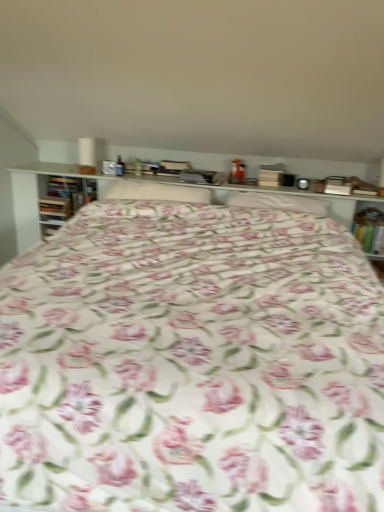
Measure the distance between point (351, 472) and camera.

The depth of point (351, 472) is 39.29 inches.

How much space does floral fabric pillow at center, the first pillow when ordered from right to left, occupy vertically?

floral fabric pillow at center, the first pillow when ordered from right to left, is 10.44 centimeters tall.

At what (x,y) coordinates should I click in order to perform the action: click on wooden book at left, which is the first book in left-to-right order. Please return your answer as a coordinate pair (x, y). The image size is (384, 512). Looking at the image, I should click on (54, 209).

From the image's perspective, count 1st books downward from the hardcover book at left, acting as the second book starting from the left, and point to it. Please provide its 2D coordinates.

[(54, 209)]

Can you tell me how much hardcover book at left, acting as the second book starting from the left, and wooden book at left, which is the first book in left-to-right order, differ in facing direction?

0.00331 degrees separate the facing orientations of hardcover book at left, acting as the second book starting from the left, and wooden book at left, which is the first book in left-to-right order.

Does point (81, 184) come behind point (42, 214)?

Yes, it is.

Is floral fabric bed at center shorter than wooden book at left, which is the first book in left-to-right order?

No, floral fabric bed at center is not shorter than wooden book at left, which is the first book in left-to-right order.

From the image's perspective, is floral fabric bed at center positioned above or below wooden book at left, which appears as the third book when viewed from the right?

floral fabric bed at center is situated lower than wooden book at left, which appears as the third book when viewed from the right, in the image.

This screenshot has height=512, width=384. Identify the location of bed below the wooden book at left, which is the first book in left-to-right order (from the image's perspective). (192, 364).

Based on their sizes in the image, would you say floral fabric bed at center is bigger or smaller than wooden book at left, which appears as the third book when viewed from the right?

Considering their sizes, floral fabric bed at center takes up more space than wooden book at left, which appears as the third book when viewed from the right.

From a real-world perspective, is hardcover book at right, which appears as the first book when viewed from the right, located beneath wooden book at left, which is the first book in left-to-right order?

Incorrect, from a real-world perspective, hardcover book at right, which appears as the first book when viewed from the right, is higher than wooden book at left, which is the first book in left-to-right order.

Is hardcover book at right, which appears as the first book when viewed from the right, placed right next to wooden book at left, which is the first book in left-to-right order?

There is a gap between hardcover book at right, which appears as the first book when viewed from the right, and wooden book at left, which is the first book in left-to-right order.

From the hardcover book at right, positioned as the third book in left-to-right order, count the 2nd book to the left and point to it. Please provide its 2D coordinates.

[(54, 209)]

Does floral fabric bed at center have a lesser width compared to hardcover book at right, which appears as the first book when viewed from the right?

Incorrect, the width of floral fabric bed at center is not less than that of hardcover book at right, which appears as the first book when viewed from the right.

Is floral fabric bed at center positioned with its back to hardcover book at right, which appears as the first book when viewed from the right?

No, floral fabric bed at center's orientation is not away from hardcover book at right, which appears as the first book when viewed from the right.

You are a GUI agent. You are given a task and a screenshot of the screen. Output one action in this format:
    pyautogui.click(x=<x>, y=<y>)
    Task: Click on the bed that is below the hardcover book at right, positioned as the third book in left-to-right order (from the image's perspective)
    
    Given the screenshot: What is the action you would take?
    pyautogui.click(x=192, y=364)

In terms of size, does hardcover book at right, which appears as the first book when viewed from the right, appear bigger or smaller than hardcover book at left, acting as the second book starting from the left?

hardcover book at right, which appears as the first book when viewed from the right, is bigger than hardcover book at left, acting as the second book starting from the left.

Looking at this image, who is shorter, hardcover book at right, positioned as the third book in left-to-right order, or hardcover book at left, which appears as the 2th book when viewed from the right?

With less height is hardcover book at right, positioned as the third book in left-to-right order.

In order to click on the 1st book positioned below the hardcover book at left, acting as the second book starting from the left (from a real-world perspective) in this screenshot , I will do point(369,230).

Consider the image. From a real-world perspective, is white fabric pillow at center, the first pillow viewed from the left, beneath wooden book at left, which appears as the third book when viewed from the right?

No, from a real-world perspective, white fabric pillow at center, the first pillow viewed from the left, is not below wooden book at left, which appears as the third book when viewed from the right.

From the image's perspective, between white fabric pillow at center, the first pillow viewed from the left, and wooden book at left, which appears as the third book when viewed from the right, who is located below?

wooden book at left, which appears as the third book when viewed from the right, is shown below in the image.

This screenshot has height=512, width=384. What are the coordinates of `the 2nd book to the left of the white fabric pillow at center, which is the second pillow in right-to-left order, starting your count from the anchor` in the screenshot? It's located at (54, 209).

Does white fabric pillow at center, the first pillow viewed from the left, turn towards wooden book at left, which appears as the third book when viewed from the right?

No, white fabric pillow at center, the first pillow viewed from the left, does not turn towards wooden book at left, which appears as the third book when viewed from the right.

Find the location of a particular element. the 2nd book to the left of the hardcover book at right, which appears as the first book when viewed from the right, counting from the anchor's position is located at coordinates (54, 209).

Are wooden book at left, which appears as the third book when viewed from the right, and hardcover book at right, positioned as the third book in left-to-right order, far apart?

wooden book at left, which appears as the third book when viewed from the right, is positioned a significant distance from hardcover book at right, positioned as the third book in left-to-right order.

Is wooden book at left, which is the first book in left-to-right order, oriented towards hardcover book at right, positioned as the third book in left-to-right order?

No, wooden book at left, which is the first book in left-to-right order, is not oriented towards hardcover book at right, positioned as the third book in left-to-right order.

Is wooden book at left, which is the first book in left-to-right order, located outside hardcover book at right, which appears as the first book when viewed from the right?

wooden book at left, which is the first book in left-to-right order, lies outside hardcover book at right, which appears as the first book when viewed from the right,'s area.

From a real-world perspective, starting from the hardcover book at left, acting as the second book starting from the left, which book is the 2nd one below it? Please provide its 2D coordinates.

[(54, 209)]

Where is `bed on the right of the wooden book at left, which appears as the third book when viewed from the right`? The width and height of the screenshot is (384, 512). bed on the right of the wooden book at left, which appears as the third book when viewed from the right is located at coordinates click(192, 364).

Looking at the image, which one is located closer to hardcover book at left, which appears as the 2th book when viewed from the right, hardcover book at right, which appears as the first book when viewed from the right, or floral fabric bed at center?

The object closer to hardcover book at left, which appears as the 2th book when viewed from the right, is floral fabric bed at center.

Which object lies further to the anchor point hardcover book at right, which appears as the first book when viewed from the right, white fabric pillow at center, the first pillow viewed from the left, or hardcover book at left, which appears as the 2th book when viewed from the right?

Based on the image, hardcover book at left, which appears as the 2th book when viewed from the right, appears to be further to hardcover book at right, which appears as the first book when viewed from the right.

Looking at the image, which one is located closer to white fabric pillow at center, the first pillow viewed from the left, floral fabric bed at center or hardcover book at left, acting as the second book starting from the left?

hardcover book at left, acting as the second book starting from the left, is closer to white fabric pillow at center, the first pillow viewed from the left.

Based on their spatial positions, is white fabric pillow at center, which is the second pillow in right-to-left order, or floral fabric pillow at center, which is counted as the second pillow, starting from the left, further from floral fabric bed at center?

Among the two, floral fabric pillow at center, which is counted as the second pillow, starting from the left, is located further to floral fabric bed at center.

In the scene shown: Which object lies further to the anchor point hardcover book at right, positioned as the third book in left-to-right order, wooden book at left, which appears as the third book when viewed from the right, or floral fabric bed at center?

wooden book at left, which appears as the third book when viewed from the right, is positioned further to the anchor hardcover book at right, positioned as the third book in left-to-right order.

In the scene shown: From the image, which object appears to be farther from floral fabric pillow at center, the first pillow when ordered from right to left, white fabric pillow at center, the first pillow viewed from the left, or floral fabric bed at center?

Based on the image, floral fabric bed at center appears to be further to floral fabric pillow at center, the first pillow when ordered from right to left.

From the image, which object appears to be nearer to hardcover book at left, which appears as the 2th book when viewed from the right, wooden book at left, which appears as the third book when viewed from the right, or floral fabric bed at center?

wooden book at left, which appears as the third book when viewed from the right.

Considering their positions, is floral fabric bed at center positioned closer to hardcover book at right, positioned as the third book in left-to-right order, than white fabric pillow at center, which is the second pillow in right-to-left order?

The object closer to hardcover book at right, positioned as the third book in left-to-right order, is white fabric pillow at center, which is the second pillow in right-to-left order.

At what (x,y) coordinates should I click in order to perform the action: click on book situated between wooden book at left, which appears as the third book when viewed from the right, and floral fabric pillow at center, which is counted as the second pillow, starting from the left, from left to right. Please return your answer as a coordinate pair (x, y). Image resolution: width=384 pixels, height=512 pixels. Looking at the image, I should click on (65, 197).

You are a GUI agent. You are given a task and a screenshot of the screen. Output one action in this format:
    pyautogui.click(x=<x>, y=<y>)
    Task: Click on the book located between wooden book at left, which appears as the third book when viewed from the right, and white fabric pillow at center, the first pillow viewed from the left, in the left-right direction
    
    Given the screenshot: What is the action you would take?
    pyautogui.click(x=65, y=197)

Locate an element on the screen. This screenshot has height=512, width=384. pillow between floral fabric bed at center and white fabric pillow at center, which is the second pillow in right-to-left order, in the front-back direction is located at coordinates (277, 202).

At what (x,y) coordinates should I click in order to perform the action: click on book between wooden book at left, which is the first book in left-to-right order, and hardcover book at right, positioned as the third book in left-to-right order, from left to right. Please return your answer as a coordinate pair (x, y). The width and height of the screenshot is (384, 512). Looking at the image, I should click on (65, 197).